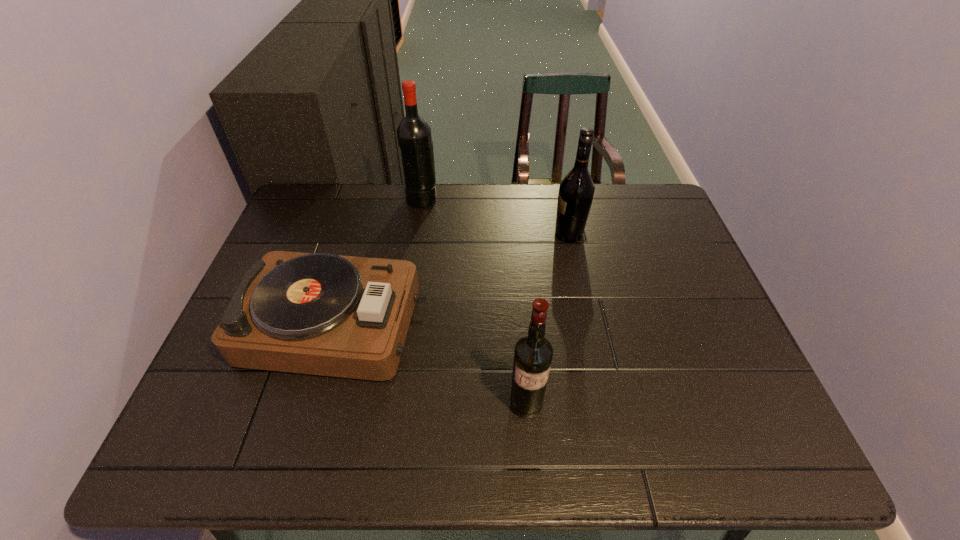
Identify the location of unoccupied position between the rightmost object and the farthest object. The height and width of the screenshot is (540, 960). (495, 216).

What are the coordinates of `unoccupied position between the nearest object and the farthest wine bottle` in the screenshot? It's located at (474, 301).

Locate an element on the screen. Image resolution: width=960 pixels, height=540 pixels. free point between the rightmost wine bottle and the third object from left to right is located at coordinates (547, 319).

Image resolution: width=960 pixels, height=540 pixels. Identify the location of free space between the second farthest object and the farthest object. (495, 216).

Locate an element on the screen. free spot between the record player and the third object from left to right is located at coordinates (431, 364).

The height and width of the screenshot is (540, 960). What are the coordinates of `vacant space in between the record player and the rightmost object` in the screenshot? It's located at (452, 279).

The image size is (960, 540). I want to click on the closest object relative to the rightmost object, so click(x=414, y=137).

Locate which object is the third closest to the second object from right to left. Please provide its 2D coordinates. Your answer should be formatted as a tuple, i.e. [(x, y)], where the tuple contains the x and y coordinates of a point satisfying the conditions above.

[(414, 137)]

Select which wine bottle is the closest to the leftmost wine bottle. Please provide its 2D coordinates. Your answer should be formatted as a tuple, i.e. [(x, y)], where the tuple contains the x and y coordinates of a point satisfying the conditions above.

[(576, 191)]

Point out which wine bottle is positioned as the second nearest to the leftmost wine bottle. Please provide its 2D coordinates. Your answer should be formatted as a tuple, i.e. [(x, y)], where the tuple contains the x and y coordinates of a point satisfying the conditions above.

[(533, 353)]